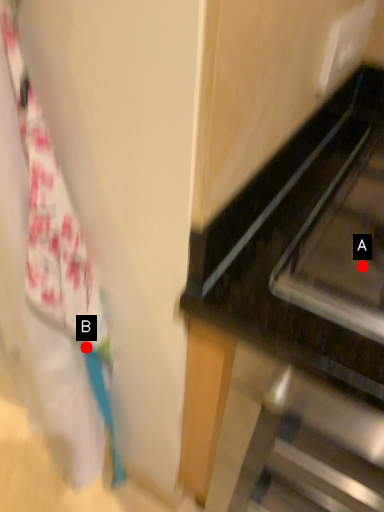
Question: Two points are circled on the image, labeled by A and B beside each circle. Which point is farther from the camera taking this photo?

Choices:
 (A) A is further
 (B) B is further

Answer: (B)